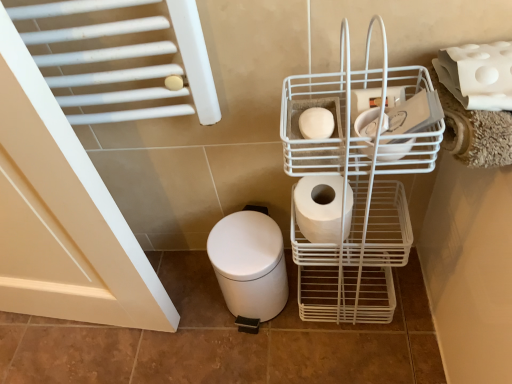
Question: Can you confirm if white matte toilet bowl at lower left is positioned to the left of white matte toilet paper at upper right, which is counted as the 1th toilet paper, starting from the right?

Choices:
 (A) no
 (B) yes

Answer: (B)

Question: Does white matte toilet bowl at lower left have a lesser width compared to white matte toilet paper at upper right, which is counted as the 1th toilet paper, starting from the right?

Choices:
 (A) yes
 (B) no

Answer: (B)

Question: Can you confirm if white matte toilet bowl at lower left is wider than white matte toilet paper at upper right, the 4th toilet paper in the left-to-right sequence?

Choices:
 (A) yes
 (B) no

Answer: (A)

Question: Is white matte toilet bowl at lower left positioned beyond the bounds of white matte toilet paper at upper right, which is counted as the 1th toilet paper, starting from the right?

Choices:
 (A) yes
 (B) no

Answer: (A)

Question: Is white matte toilet bowl at lower left directly adjacent to white matte toilet paper at upper right, which is counted as the 1th toilet paper, starting from the right?

Choices:
 (A) no
 (B) yes

Answer: (A)

Question: In the image, is white wire basket at center right on the left side or the right side of white matte toilet paper at upper right, the 4th toilet paper in the left-to-right sequence?

Choices:
 (A) right
 (B) left

Answer: (B)

Question: In terms of size, does white wire basket at center right appear bigger or smaller than white matte toilet paper at upper right, which is counted as the 1th toilet paper, starting from the right?

Choices:
 (A) big
 (B) small

Answer: (A)

Question: From the image's perspective, is white wire basket at center right positioned above or below white matte toilet paper at upper right, which is counted as the 1th toilet paper, starting from the right?

Choices:
 (A) below
 (B) above

Answer: (A)

Question: From a real-world perspective, is white wire basket at center right positioned above or below white matte toilet paper at upper right, which is counted as the 1th toilet paper, starting from the right?

Choices:
 (A) below
 (B) above

Answer: (A)

Question: Is white matte toilet paper at center-right, the second toilet paper when ordered from left to right, situated inside white matte toilet paper at upper right, which is counted as the 1th toilet paper, starting from the right, or outside?

Choices:
 (A) outside
 (B) inside

Answer: (A)

Question: Is white matte toilet paper at center-right, the second toilet paper when ordered from left to right, taller or shorter than white matte toilet paper at upper right, the 4th toilet paper in the left-to-right sequence?

Choices:
 (A) short
 (B) tall

Answer: (B)

Question: Does point (338, 180) appear closer or farther from the camera than point (464, 62)?

Choices:
 (A) farther
 (B) closer

Answer: (A)

Question: Looking at their shapes, would you say white matte toilet paper at center-right, marked as the third toilet paper in a right-to-left arrangement, is wider or thinner than white matte toilet paper at upper right, which is counted as the 1th toilet paper, starting from the right?

Choices:
 (A) wide
 (B) thin

Answer: (B)

Question: From a real-world perspective, is white matte toilet paper at center right, the third toilet paper from the left, physically located above or below white matte toilet bowl at lower left?

Choices:
 (A) below
 (B) above

Answer: (B)

Question: From the image's perspective, is white matte toilet paper at center right, which ranks as the second toilet paper in right-to-left order, above or below white matte toilet bowl at lower left?

Choices:
 (A) above
 (B) below

Answer: (A)